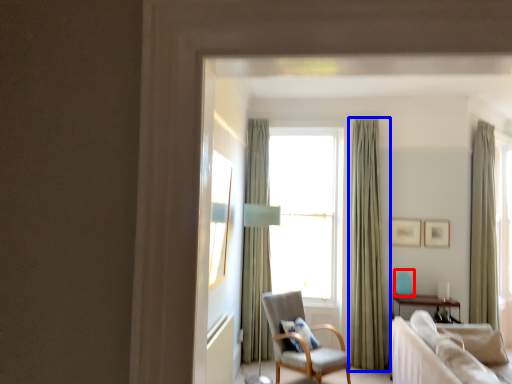
Question: Which of the following is the farthest to the observer, teal (highlighted by a red box) or curtain (highlighted by a blue box)?

Choices:
 (A) teal
 (B) curtain

Answer: (A)